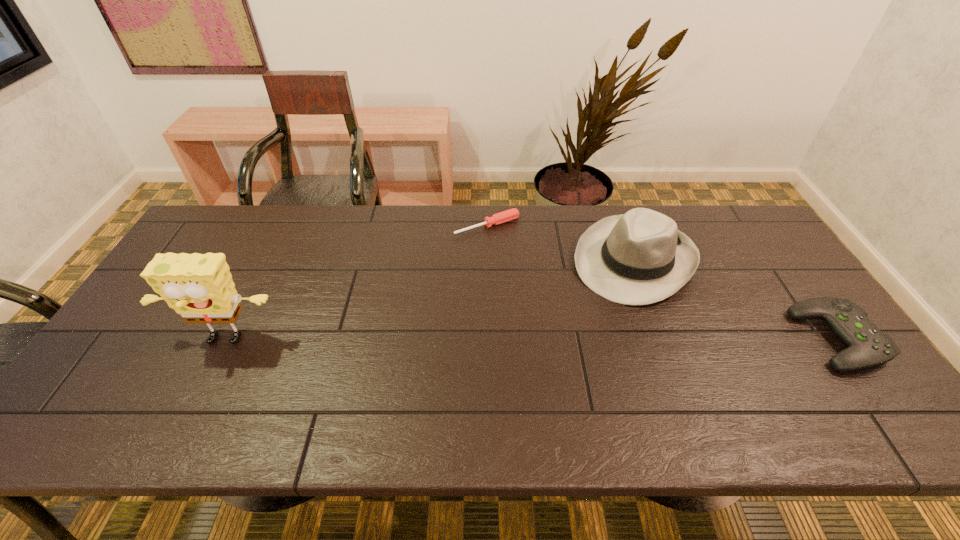
Where is `object that is at the near right corner`? object that is at the near right corner is located at coordinates (868, 346).

Locate an element on the screen. vacant space at the far edge of the desktop is located at coordinates (275, 228).

Find the location of a particular element. free space at the near edge of the desktop is located at coordinates (579, 390).

The height and width of the screenshot is (540, 960). Identify the location of free region at the right edge. (781, 260).

Locate an element on the screen. free space at the far right corner is located at coordinates (725, 210).

You are a GUI agent. You are given a task and a screenshot of the screen. Output one action in this format:
    pyautogui.click(x=<x>, y=<y>)
    Task: Click on the free region at the near right corner of the desktop
    The height and width of the screenshot is (540, 960).
    Given the screenshot: What is the action you would take?
    pyautogui.click(x=818, y=377)

Image resolution: width=960 pixels, height=540 pixels. In order to click on free spot between the tallest object and the second shortest object in this screenshot , I will do `click(531, 340)`.

Locate an element on the screen. This screenshot has width=960, height=540. free space between the fedora and the control is located at coordinates (736, 300).

The image size is (960, 540). I want to click on free area in between the leftmost object and the rightmost object, so click(531, 340).

What are the coordinates of `vacant space that's between the rightmost object and the second object from right to left` in the screenshot? It's located at [x=736, y=300].